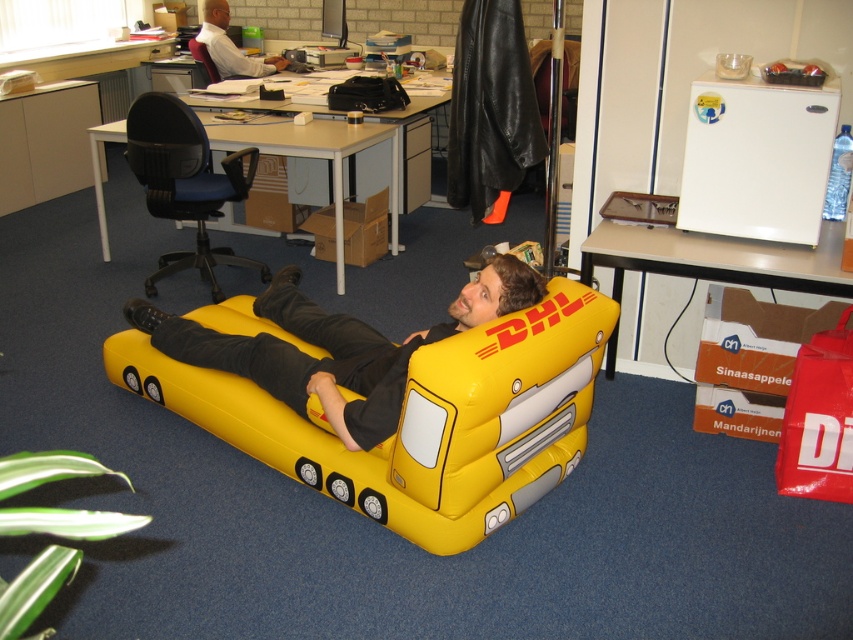
Can you confirm if white plastic computer desk at lower right is positioned below matte white desk at center?

Yes.

Is white plastic computer desk at lower right shorter than matte white desk at center?

Correct, white plastic computer desk at lower right is not as tall as matte white desk at center.

Who is more distant from viewer, (711, 253) or (113, 132)?

The point (113, 132) is more distant.

I want to click on white plastic computer desk at lower right, so click(717, 259).

Does yellow fabric bean bag chair at center have a smaller size compared to white shirt at upper left?

No.

From the picture: Is yellow fabric bean bag chair at center taller than white shirt at upper left?

Indeed, yellow fabric bean bag chair at center has a greater height compared to white shirt at upper left.

The height and width of the screenshot is (640, 853). What do you see at coordinates (184, 182) in the screenshot?
I see `yellow fabric bean bag chair at center` at bounding box center [184, 182].

You are a GUI agent. You are given a task and a screenshot of the screen. Output one action in this format:
    pyautogui.click(x=<x>, y=<y>)
    Task: Click on the yellow fabric bean bag chair at center
    
    Given the screenshot: What is the action you would take?
    pyautogui.click(x=184, y=182)

Is point (144, 102) closer to camera compared to point (212, 72)?

Yes, it is in front of point (212, 72).

Does point (183, 202) lie behind point (209, 65)?

No, (183, 202) is closer to viewer.

Which is in front, point (202, 276) or point (218, 70)?

Positioned in front is point (202, 276).

You are a GUI agent. You are given a task and a screenshot of the screen. Output one action in this format:
    pyautogui.click(x=<x>, y=<y>)
    Task: Click on the yellow fabric bean bag chair at center
    
    Given the screenshot: What is the action you would take?
    pyautogui.click(x=184, y=182)